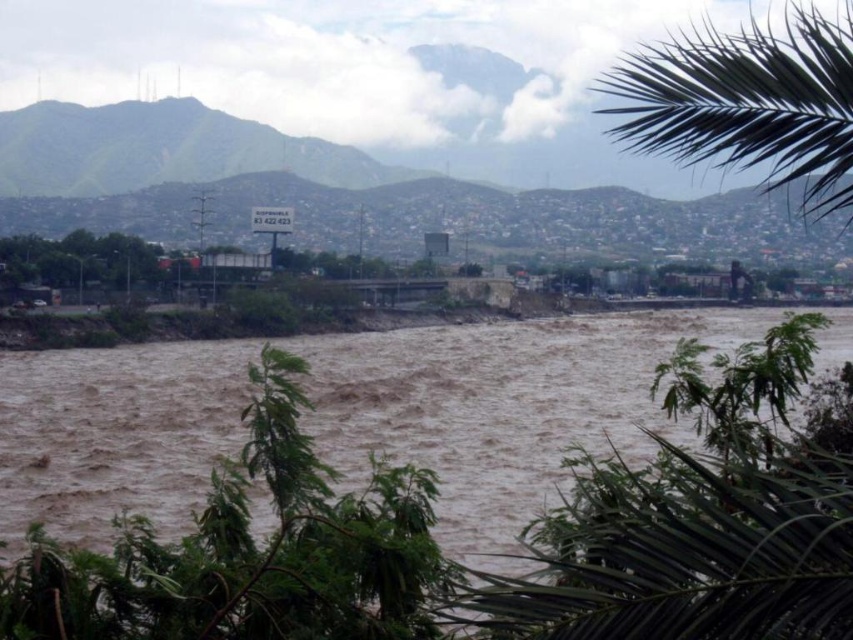
Find the location of a particular element. The image size is (853, 640). brown muddy water at center is located at coordinates (523, 532).

Is brown muddy water at center bigger than green leafy mountain at upper left?

Yes, brown muddy water at center is bigger than green leafy mountain at upper left.

Is point (769, 550) positioned after point (343, 150)?

No, (769, 550) is in front of (343, 150).

Locate an element on the screen. The height and width of the screenshot is (640, 853). brown muddy water at center is located at coordinates (523, 532).

Is green leafy palm at upper right shorter than green leafy mountain at upper left?

In fact, green leafy palm at upper right may be taller than green leafy mountain at upper left.

At what (x,y) coordinates should I click in order to perform the action: click on green leafy palm at upper right. Please return your answer as a coordinate pair (x, y). Looking at the image, I should click on (747, 102).

Between point (708, 83) and point (189, 161), which one is positioned behind?

Positioned behind is point (189, 161).

At what (x,y) coordinates should I click in order to perform the action: click on green leafy palm at upper right. Please return your answer as a coordinate pair (x, y). Image resolution: width=853 pixels, height=640 pixels. Looking at the image, I should click on (747, 102).

In the scene shown: Is brown muddy water at center above green leafy palm at upper right?

No, brown muddy water at center is not above green leafy palm at upper right.

Is brown muddy water at center below green leafy palm at upper right?

Yes, brown muddy water at center is below green leafy palm at upper right.

Is point (801, 330) less distant than point (773, 170)?

Yes.

Locate an element on the screen. brown muddy water at center is located at coordinates (523, 532).